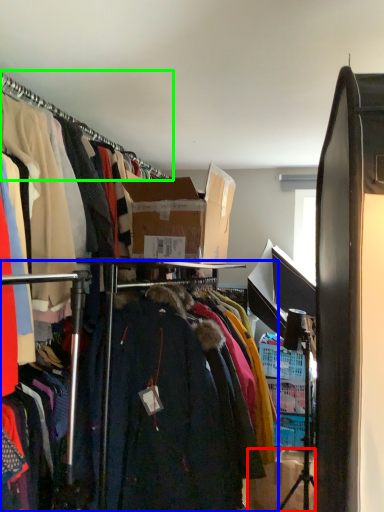
Question: Which object is the farthest from box (highlighted by a red box)? Choose among these: closet (highlighted by a blue box) or hanger (highlighted by a green box).

Choices:
 (A) closet
 (B) hanger

Answer: (B)